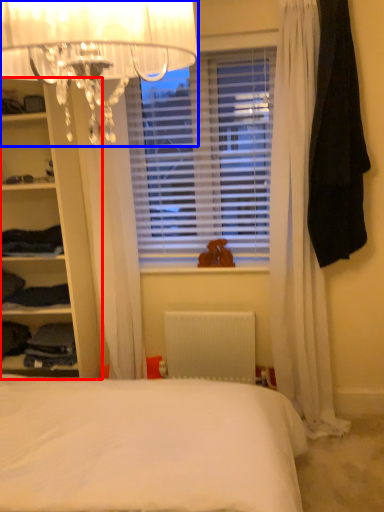
Question: Which point is further to the camera, shelf (highlighted by a red box) or lamp (highlighted by a blue box)?

Choices:
 (A) shelf
 (B) lamp

Answer: (A)